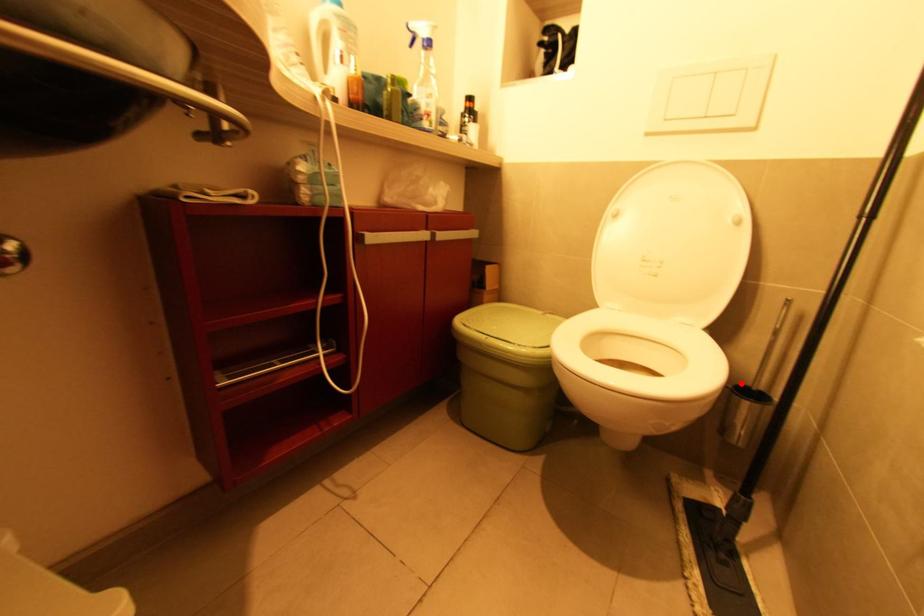
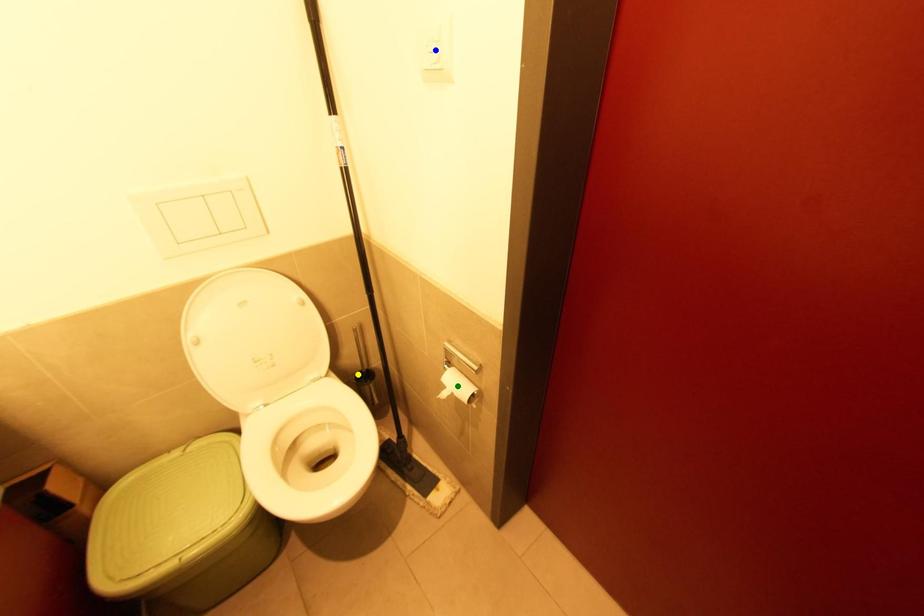
Question: I am providing you with two images of the same scene from different viewpoints. A red point is marked on the first image. You are given multiple points on the second image. Which point in image 2 is actually the same real-world point as the red point in image 1?

Choices:
 (A) blue point
 (B) yellow point
 (C) green point

Answer: (B)